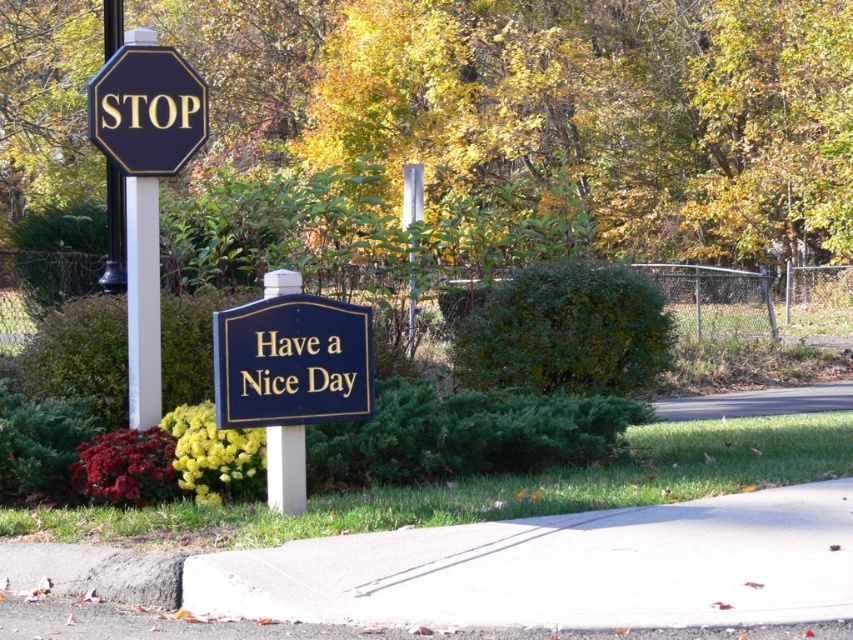
Who is more forward, (310, 349) or (277, 474)?

Positioned in front is point (310, 349).

Is glossy blue sign at center to the left of white plastic sign post at center from the viewer's perspective?

In fact, glossy blue sign at center is to the right of white plastic sign post at center.

Does point (245, 358) come behind point (270, 442)?

No, (245, 358) is in front of (270, 442).

The height and width of the screenshot is (640, 853). Identify the location of glossy blue sign at center. (292, 362).

Between glossy blue sign at center and matte black octagon at upper left, which one has more height?

With more height is matte black octagon at upper left.

Does glossy blue sign at center have a lesser width compared to matte black octagon at upper left?

No.

Is point (341, 344) positioned before point (161, 106)?

Yes.

Find the location of `glossy blue sign at center`. glossy blue sign at center is located at coordinates (292, 362).

Is point (280, 376) positioned in front of point (123, 188)?

Yes, point (280, 376) is in front of point (123, 188).

Which is above, glossy blue sign at center or black metal pole at left?

black metal pole at left is above.

Who is more distant from viewer, (370, 337) or (108, 33)?

Positioned behind is point (108, 33).

Find the location of a particular element. This screenshot has height=640, width=853. glossy blue sign at center is located at coordinates (292, 362).